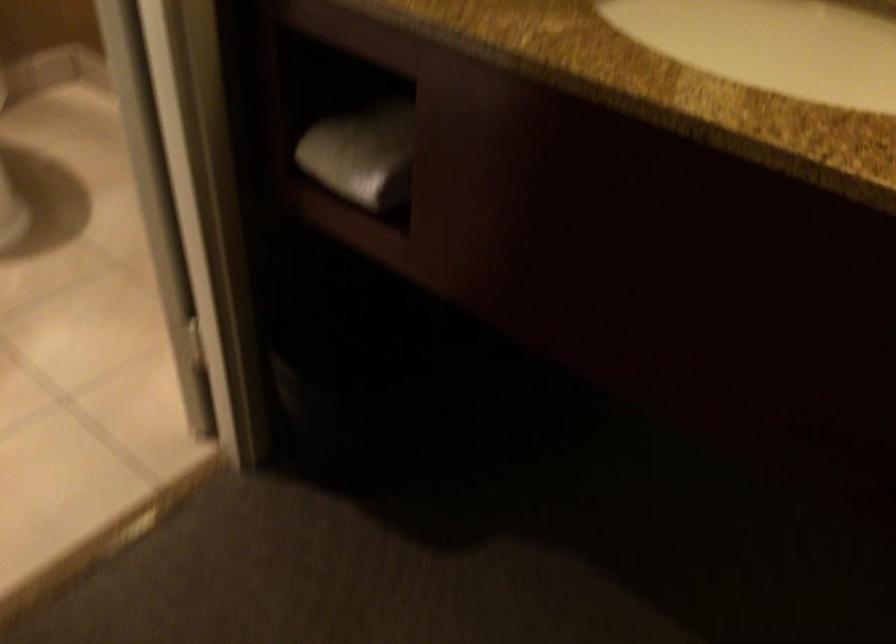
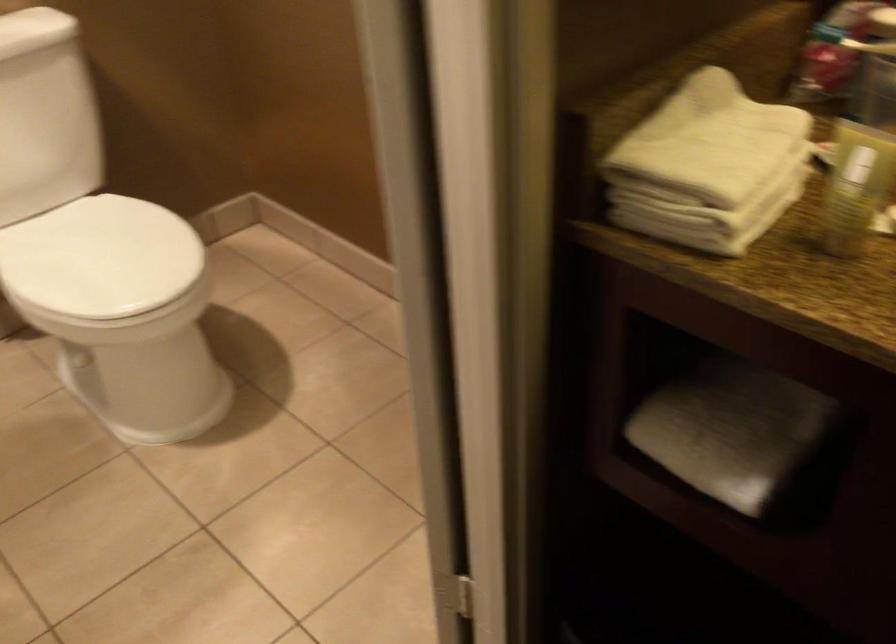
Looking at this image, what movement of the cameraman would produce the second image?

The cameraman moved toward left, forward.